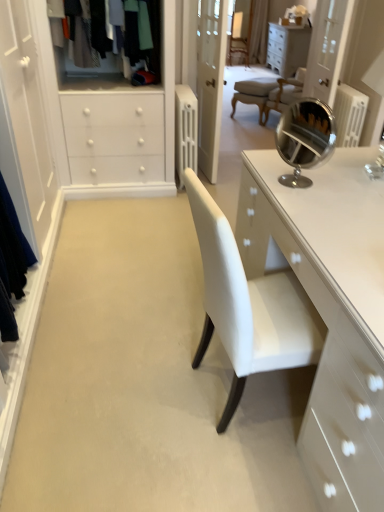
Question: Is white glossy cabinet at upper center turned away from transparent glass door at upper right?

Choices:
 (A) no
 (B) yes

Answer: (A)

Question: From a real-world perspective, is white glossy cabinet at upper center on top of transparent glass door at upper right?

Choices:
 (A) no
 (B) yes

Answer: (A)

Question: Is white glossy cabinet at upper center smaller than transparent glass door at upper right?

Choices:
 (A) yes
 (B) no

Answer: (B)

Question: Considering the relative sizes of white glossy cabinet at upper center and transparent glass door at upper right in the image provided, is white glossy cabinet at upper center thinner than transparent glass door at upper right?

Choices:
 (A) yes
 (B) no

Answer: (B)

Question: From the image's perspective, is white glossy cabinet at upper center located above transparent glass door at upper right?

Choices:
 (A) no
 (B) yes

Answer: (B)

Question: From a real-world perspective, relative to white glossy cabinet at upper center, is polished chrome mirror at upper right vertically above or below?

Choices:
 (A) above
 (B) below

Answer: (A)

Question: Considering their positions, is polished chrome mirror at upper right located in front of or behind white glossy cabinet at upper center?

Choices:
 (A) front
 (B) behind

Answer: (A)

Question: Would you say polished chrome mirror at upper right is inside or outside white glossy cabinet at upper center?

Choices:
 (A) outside
 (B) inside

Answer: (A)

Question: Visually, is polished chrome mirror at upper right positioned to the left or to the right of white glossy cabinet at upper center?

Choices:
 (A) left
 (B) right

Answer: (A)

Question: Is point (342, 53) positioned closer to the camera than point (137, 27)?

Choices:
 (A) closer
 (B) farther

Answer: (B)

Question: Considering the positions of transparent glass door at upper right and textured wool sweater at upper left in the image, is transparent glass door at upper right taller or shorter than textured wool sweater at upper left?

Choices:
 (A) short
 (B) tall

Answer: (B)

Question: Considering the relative positions of transparent glass door at upper right and textured wool sweater at upper left in the image provided, is transparent glass door at upper right to the left or to the right of textured wool sweater at upper left?

Choices:
 (A) left
 (B) right

Answer: (B)

Question: From a real-world perspective, is transparent glass door at upper right physically located above or below textured wool sweater at upper left?

Choices:
 (A) above
 (B) below

Answer: (B)

Question: Is transparent glass door at upper right bigger or smaller than polished chrome mirror at upper right?

Choices:
 (A) big
 (B) small

Answer: (A)

Question: Is transparent glass door at upper right taller or shorter than polished chrome mirror at upper right?

Choices:
 (A) short
 (B) tall

Answer: (B)